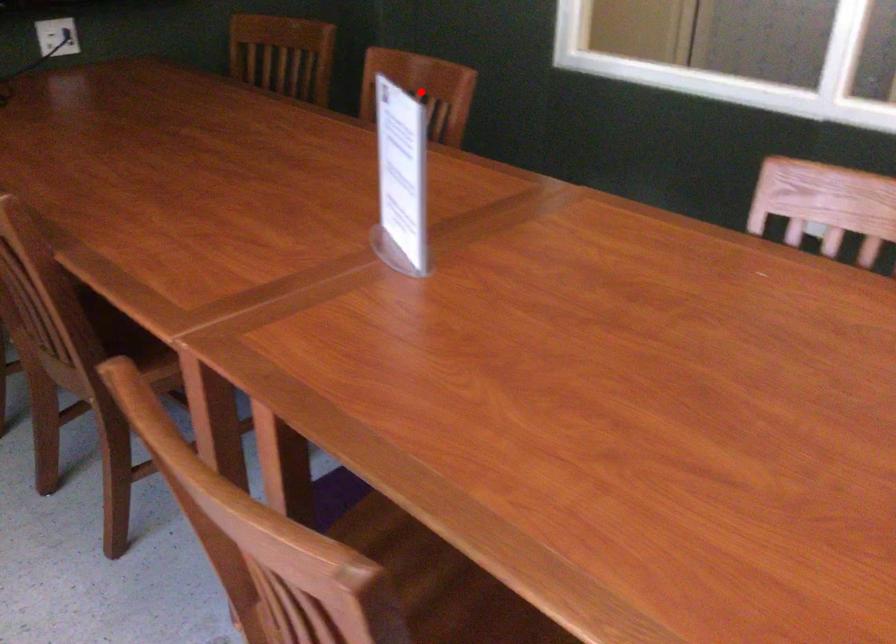
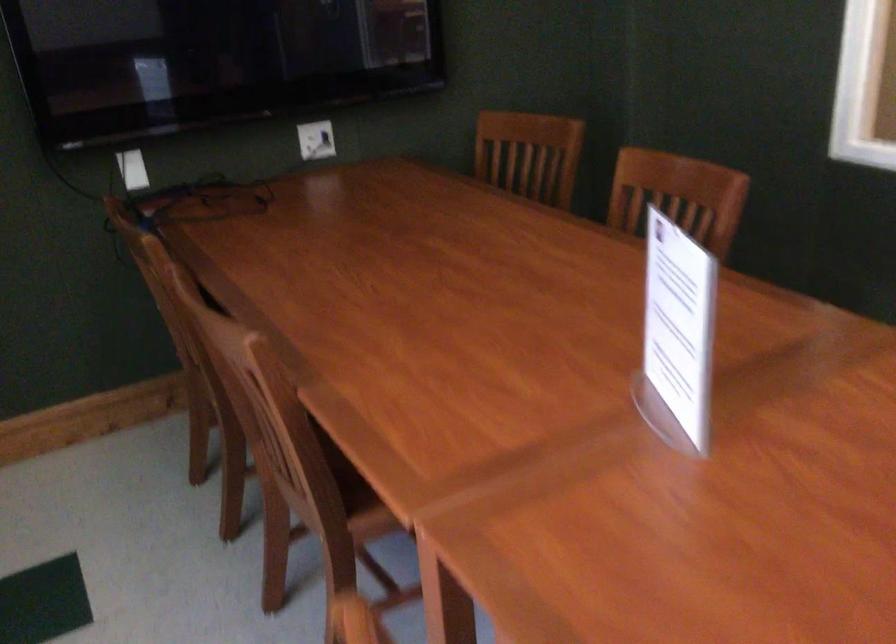
Question: I am providing you with two images of the same scene from different viewpoints. Given a red point in image1, look at the same physical point in image2. Is it:

Choices:
 (A) Closer to the viewpoint
 (B) Farther from the viewpoint

Answer: (A)